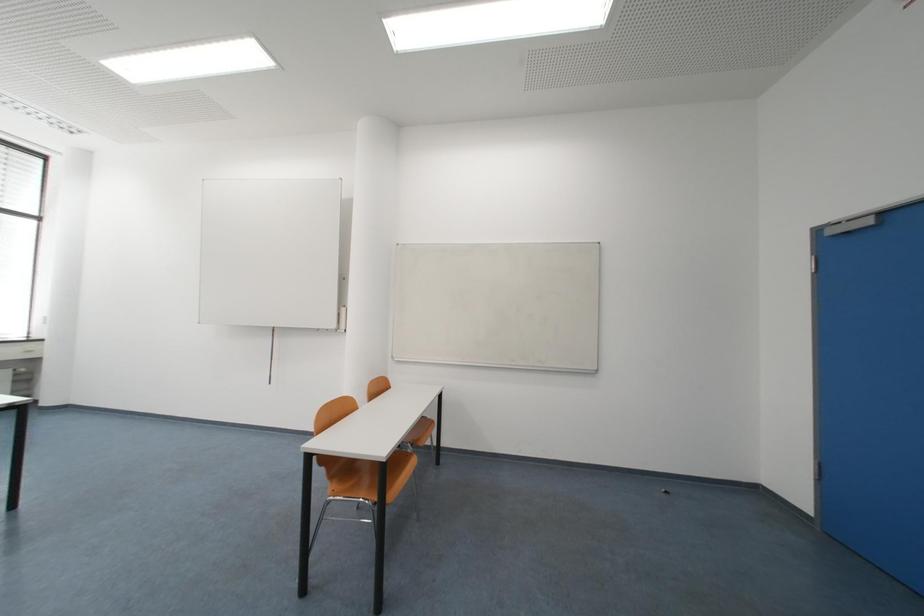
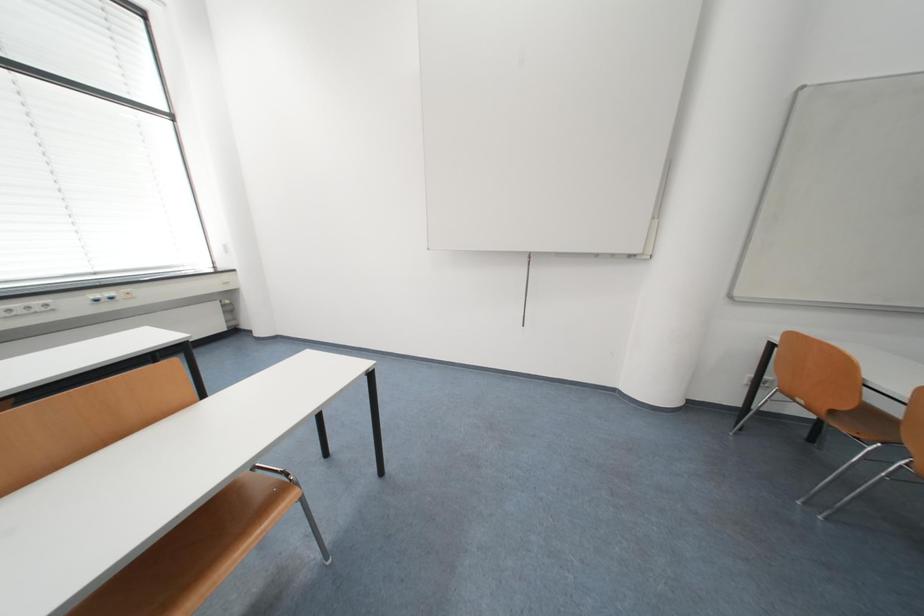
Question: In a continuous first-person perspective shot, in which direction is the camera moving?

Choices:
 (A) Left
 (B) Right
 (C) Forward
 (D) Backward

Answer: (A)